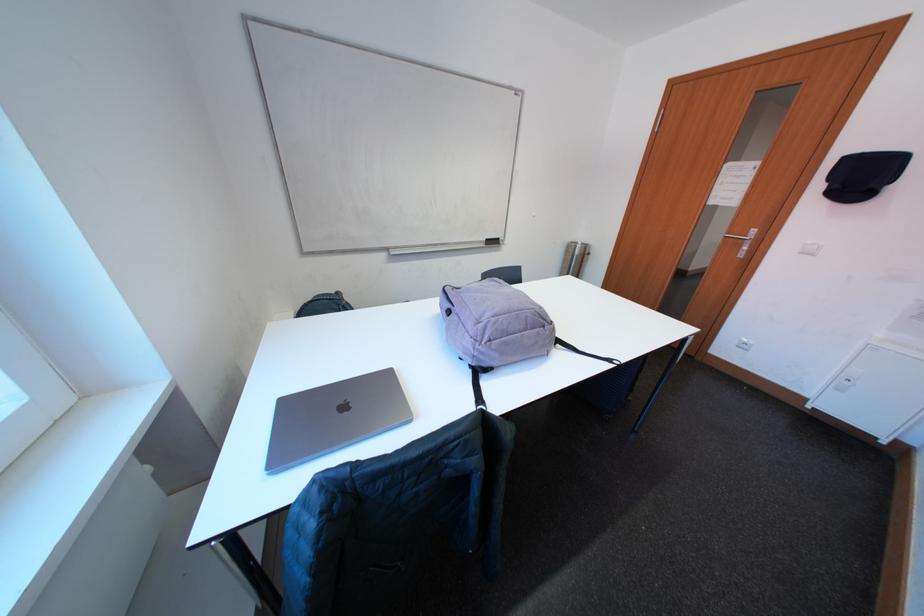
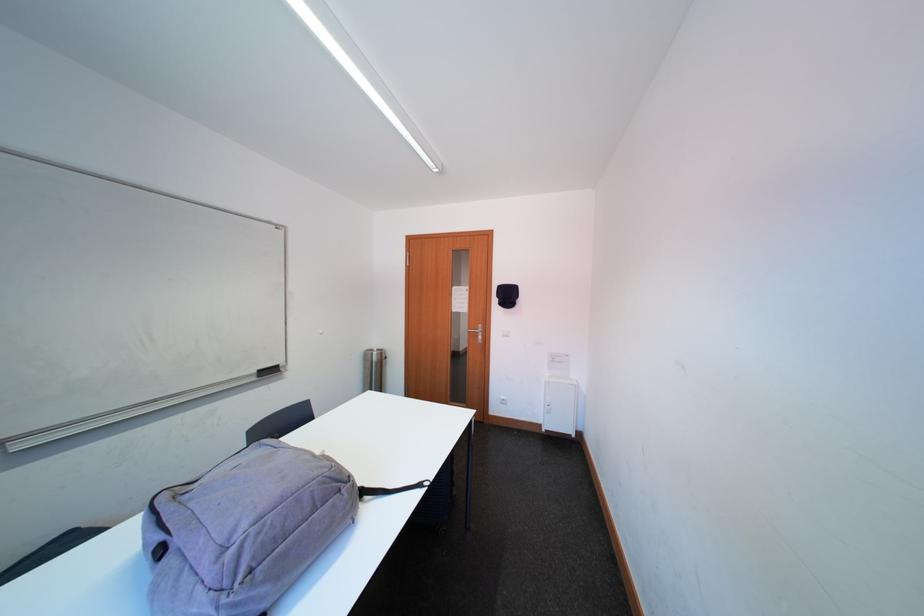
Find the pixel in the second image that matches point 586,251 in the first image.

(382, 358)